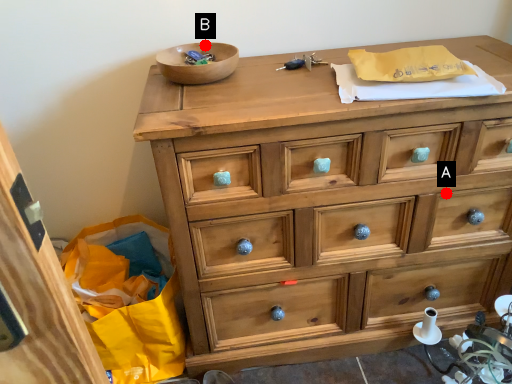
Question: Two points are circled on the image, labeled by A and B beside each circle. Which point is further to the camera?

Choices:
 (A) A is further
 (B) B is further

Answer: (B)